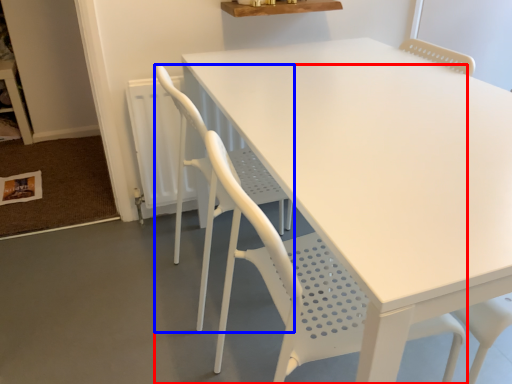
Question: Which point is further to the camera, chair (highlighted by a red box) or chair (highlighted by a blue box)?

Choices:
 (A) chair
 (B) chair

Answer: (B)